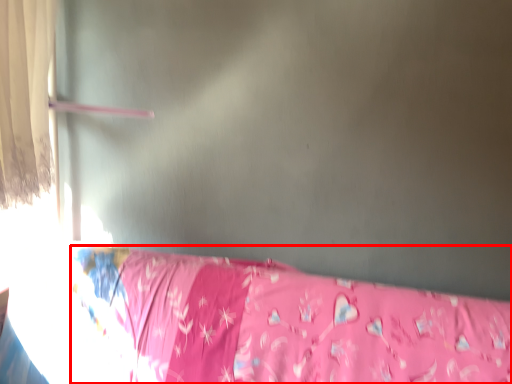
Question: From the image's perspective, where is furniture (annotated by the red box) located relative to curtain?

Choices:
 (A) above
 (B) below

Answer: (B)